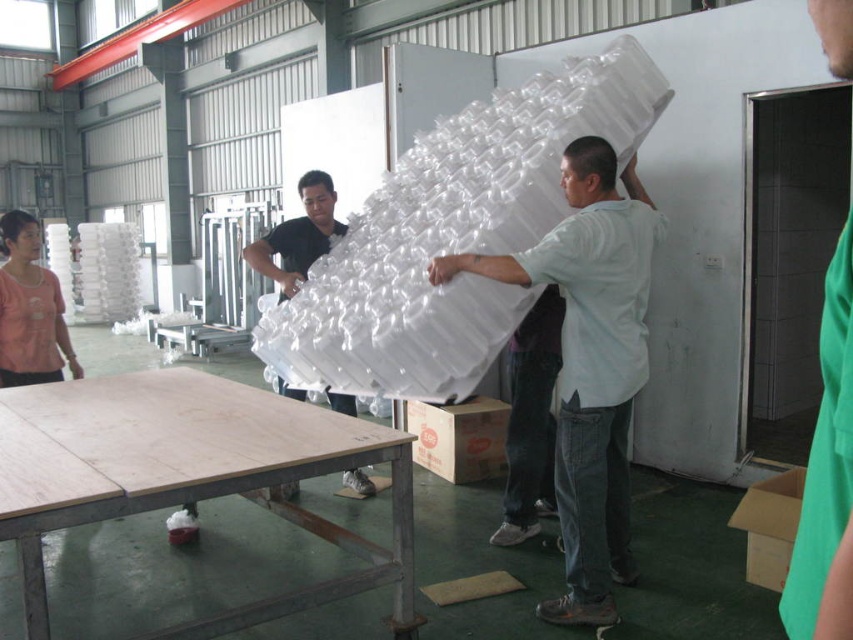
Question: Among these objects, which one is farthest from the camera?

Choices:
 (A) white matte foam at center
 (B) brown cardboard box at lower right
 (C) brown cardboard box at center

Answer: (C)

Question: Is white matte foam at center thinner than brown cardboard box at lower right?

Choices:
 (A) yes
 (B) no

Answer: (B)

Question: Is brown cardboard box at center wider than brown cardboard box at lower right?

Choices:
 (A) yes
 (B) no

Answer: (A)

Question: Among these objects, which one is nearest to the camera?

Choices:
 (A) brown cardboard box at center
 (B) white matte bubble wrap at center

Answer: (B)

Question: Is white matte bubble wrap at center closer to camera compared to brown cardboard box at center?

Choices:
 (A) yes
 (B) no

Answer: (A)

Question: Which of the following is the farthest from the observer?

Choices:
 (A) white matte bubble wrap at center
 (B) white matte foam at center
 (C) brown cardboard box at center

Answer: (C)